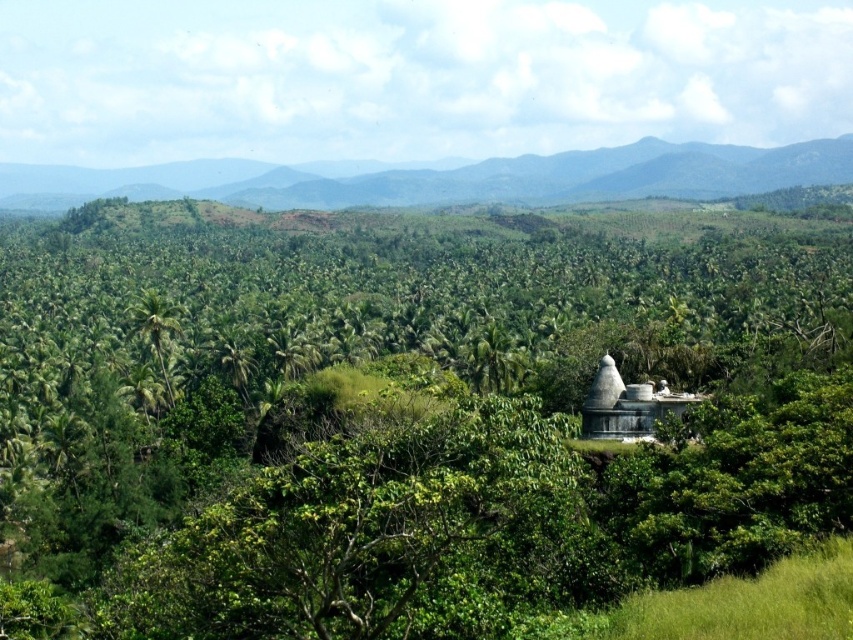
Question: Is green leafy mountain at upper center below green leafy palm tree at center?

Choices:
 (A) no
 (B) yes

Answer: (A)

Question: Which point is closer to the camera?

Choices:
 (A) (212, 198)
 (B) (793, 509)
 (C) (148, 328)

Answer: (B)

Question: Can you confirm if green leafy tree at center is positioned to the right of green leafy mountain at upper center?

Choices:
 (A) no
 (B) yes

Answer: (B)

Question: Which of the following is the farthest from the observer?

Choices:
 (A) green leafy mountain at upper center
 (B) green leafy tree at center
 (C) green leafy palm tree at center

Answer: (A)

Question: Based on their relative distances, which object is farther from the green leafy mountain at upper center?

Choices:
 (A) green leafy tree at center
 (B) green leafy palm tree at center

Answer: (B)

Question: Is green leafy mountain at upper center to the left of green leafy palm tree at center from the viewer's perspective?

Choices:
 (A) yes
 (B) no

Answer: (B)